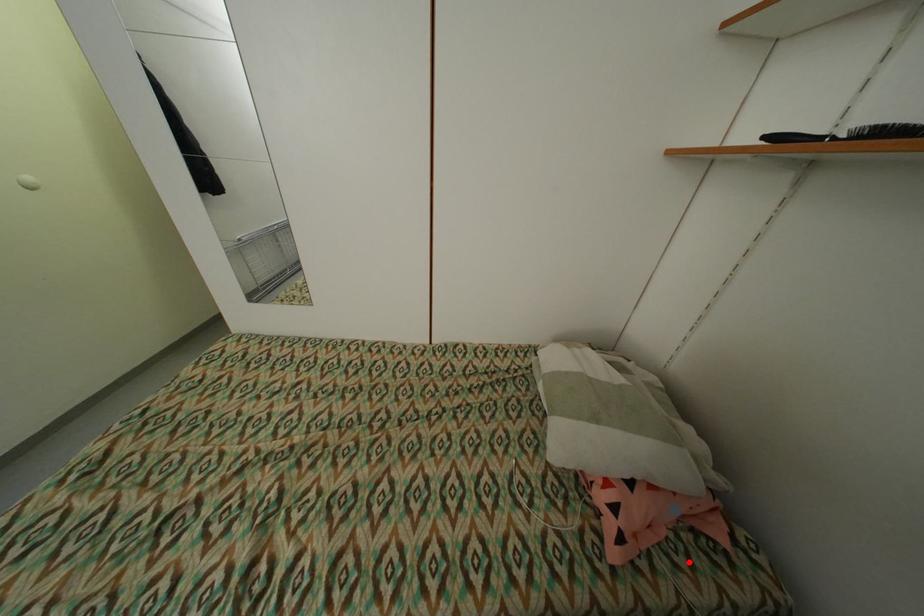
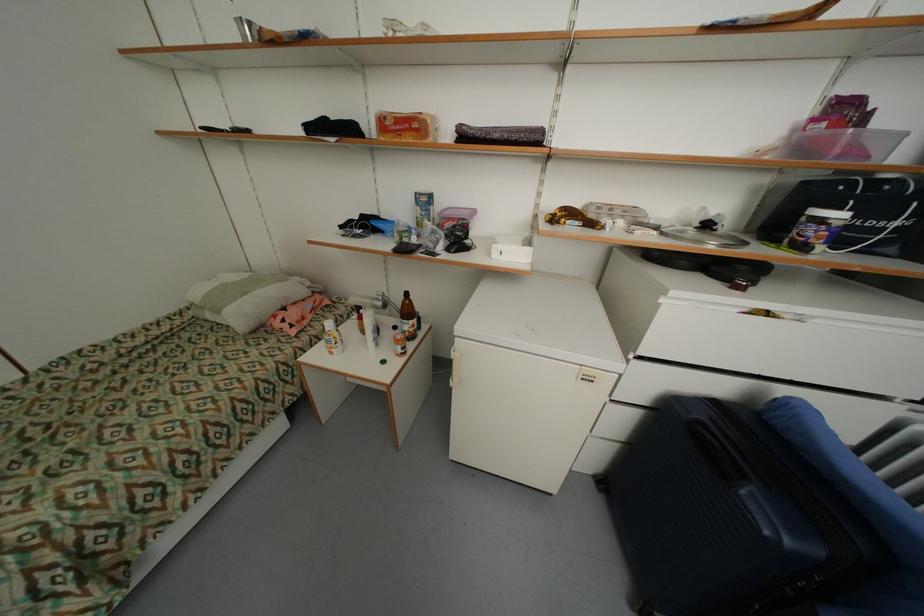
Find the pixel in the second image that matches the highlighted location in the first image.

(327, 320)